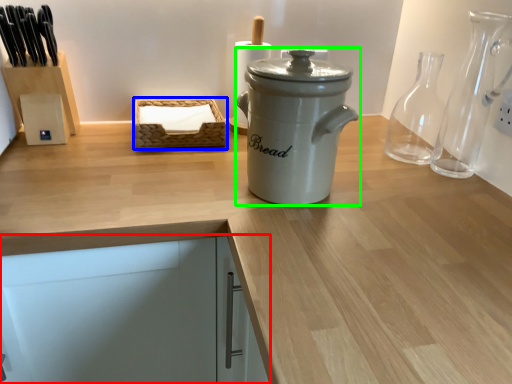
Question: Considering the real-world distances, which object is farthest from cabinetry (highlighted by a red box)? basket (highlighted by a blue box) or kitchen appliance (highlighted by a green box)?

Choices:
 (A) basket
 (B) kitchen appliance

Answer: (A)